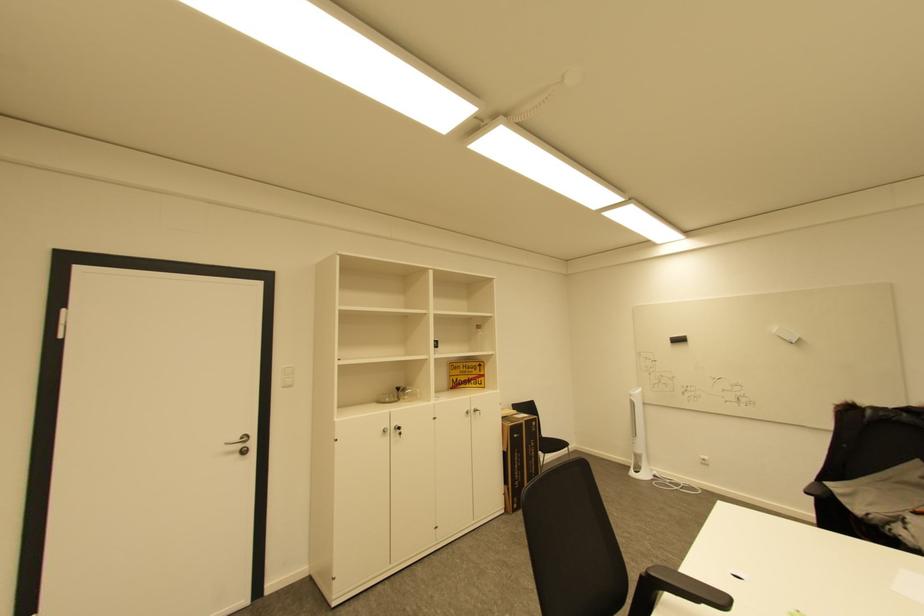
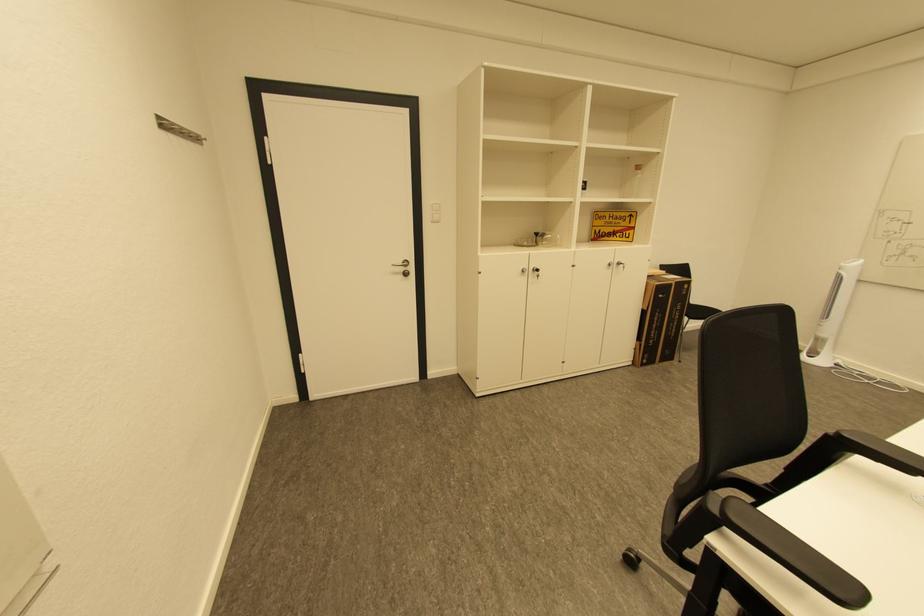
Find the pixel in the second image that matches (246,447) in the first image.

(408, 270)